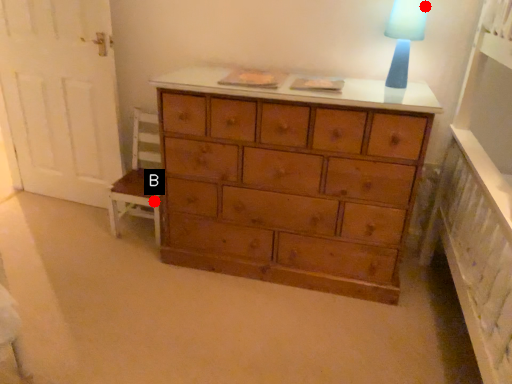
Question: Two points are circled on the image, labeled by A and B beside each circle. Which point appears closest to the camera in this image?

Choices:
 (A) A is closer
 (B) B is closer

Answer: (A)